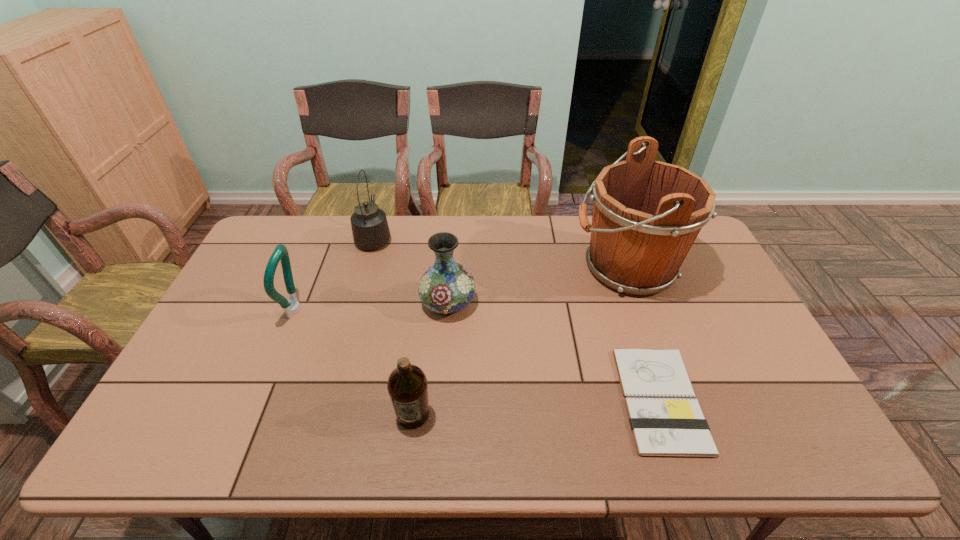
Identify the location of unoccupied area between the olive oil and the vase. The image size is (960, 540). (430, 359).

You are a GUI agent. You are given a task and a screenshot of the screen. Output one action in this format:
    pyautogui.click(x=<x>, y=<y>)
    Task: Click on the fifth closest object to the leftmost object
    
    Given the screenshot: What is the action you would take?
    pyautogui.click(x=663, y=423)

Image resolution: width=960 pixels, height=540 pixels. What are the coordinates of `object that ranks as the third closest to the vase` in the screenshot? It's located at (647, 214).

Identify the location of free space that satisfies the following two spatial constraints: 1. on the front side of the shortest object; 2. on the left side of the vase. point(441,399).